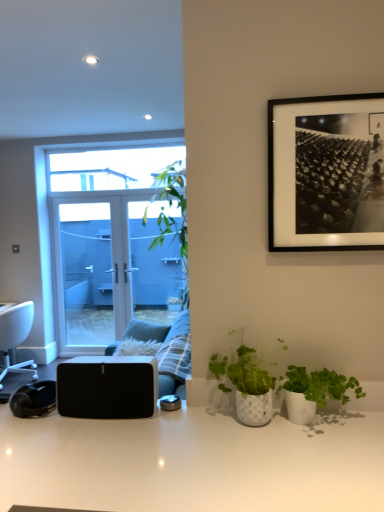
Question: Should I look upward or downward to see white plastic chair at left?

Choices:
 (A) up
 (B) down

Answer: (B)

Question: Considering the relative sizes of blue glass door at center and green matte plant at lower right, the second houseplant viewed from the left, in the image provided, is blue glass door at center bigger than green matte plant at lower right, the second houseplant viewed from the left,?

Choices:
 (A) yes
 (B) no

Answer: (A)

Question: Considering the relative sizes of blue glass door at center and green matte plant at lower right, the second houseplant viewed from the left, in the image provided, is blue glass door at center taller than green matte plant at lower right, the second houseplant viewed from the left,?

Choices:
 (A) no
 (B) yes

Answer: (B)

Question: Is the position of blue glass door at center more distant than that of green matte plant at lower right, the second houseplant viewed from the left?

Choices:
 (A) yes
 (B) no

Answer: (A)

Question: Can you confirm if blue glass door at center is smaller than green matte plant at lower right, the first houseplant positioned from the right?

Choices:
 (A) no
 (B) yes

Answer: (A)

Question: Is blue glass door at center oriented away from green matte plant at lower right, the second houseplant viewed from the left?

Choices:
 (A) yes
 (B) no

Answer: (B)

Question: Can you confirm if blue glass door at center is shorter than green matte plant at lower right, the first houseplant positioned from the right?

Choices:
 (A) yes
 (B) no

Answer: (B)

Question: Is plush fabric couch at center positioned before white glossy desk at center?

Choices:
 (A) no
 (B) yes

Answer: (A)

Question: Considering the relative positions of plush fabric couch at center and white glossy desk at center in the image provided, is plush fabric couch at center to the right of white glossy desk at center from the viewer's perspective?

Choices:
 (A) yes
 (B) no

Answer: (B)

Question: Can you confirm if plush fabric couch at center is smaller than white glossy desk at center?

Choices:
 (A) yes
 (B) no

Answer: (A)

Question: From the image's perspective, is plush fabric couch at center on top of white glossy desk at center?

Choices:
 (A) yes
 (B) no

Answer: (A)

Question: Does plush fabric couch at center have a lesser width compared to white glossy desk at center?

Choices:
 (A) no
 (B) yes

Answer: (B)

Question: Is plush fabric couch at center bigger than white glossy desk at center?

Choices:
 (A) no
 (B) yes

Answer: (A)

Question: From a real-world perspective, is white plastic chair at left physically below black matte speaker at lower left?

Choices:
 (A) no
 (B) yes

Answer: (B)